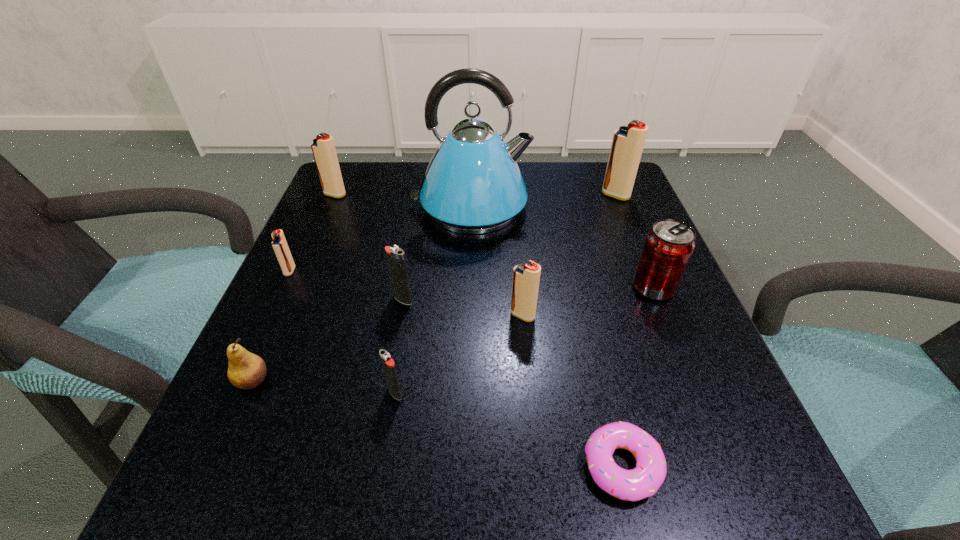
I want to click on free spot between the pear and the third farthest igniter, so [x=272, y=326].

At what (x,y) coordinates should I click in order to perform the action: click on vacant area between the eighth object from left to right and the red pop soda. Please return your answer as a coordinate pair (x, y). Image resolution: width=960 pixels, height=540 pixels. Looking at the image, I should click on (637, 377).

Locate an element on the screen. This screenshot has width=960, height=540. the closest object relative to the second tallest object is located at coordinates (473, 185).

The width and height of the screenshot is (960, 540). In order to click on object that can be found as the closest to the fourth farthest igniter in this screenshot , I will do `click(473, 185)`.

In order to click on igniter that stands as the third closest to the tallest object in this screenshot , I will do `click(627, 145)`.

Select which igniter appears as the second closest to the second smallest red igniter. Please provide its 2D coordinates. Your answer should be formatted as a tuple, i.e. [(x, y)], where the tuple contains the x and y coordinates of a point satisfying the conditions above.

[(388, 364)]

Identify the location of red igniter that is the closest to the third nearest igniter. (526, 277).

Identify which red igniter is the second closest to the second nearest igniter. Please provide its 2D coordinates. Your answer should be formatted as a tuple, i.e. [(x, y)], where the tuple contains the x and y coordinates of a point satisfying the conditions above.

[(279, 243)]

The width and height of the screenshot is (960, 540). Find the location of `free spot that satisfies the following two spatial constraints: 1. on the back side of the red pop soda; 2. on the right side of the pear`. free spot that satisfies the following two spatial constraints: 1. on the back side of the red pop soda; 2. on the right side of the pear is located at coordinates (295, 288).